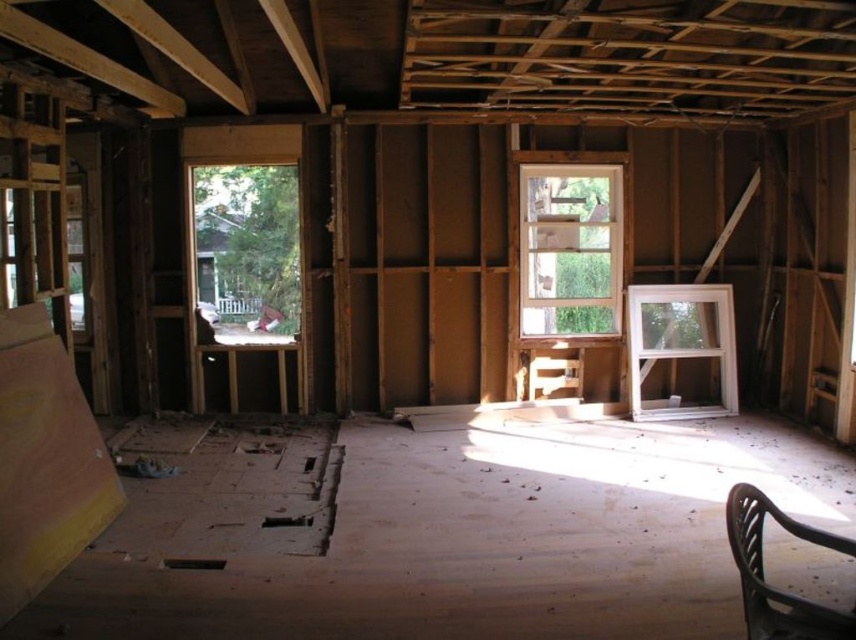
Question: Is clear glass window at center to the left of white plastic window at right from the viewer's perspective?

Choices:
 (A) yes
 (B) no

Answer: (A)

Question: Which of the following is the closest to the observer?

Choices:
 (A) (694, 298)
 (B) (614, 237)

Answer: (A)

Question: Observing the image, what is the correct spatial positioning of clear glass window at center in reference to white plastic window at right?

Choices:
 (A) right
 (B) left

Answer: (B)

Question: Which of the following is the farthest from the observer?

Choices:
 (A) clear glass window at center
 (B) white plastic window at right

Answer: (A)

Question: Can you confirm if clear glass window at center is wider than white plastic window at right?

Choices:
 (A) no
 (B) yes

Answer: (A)